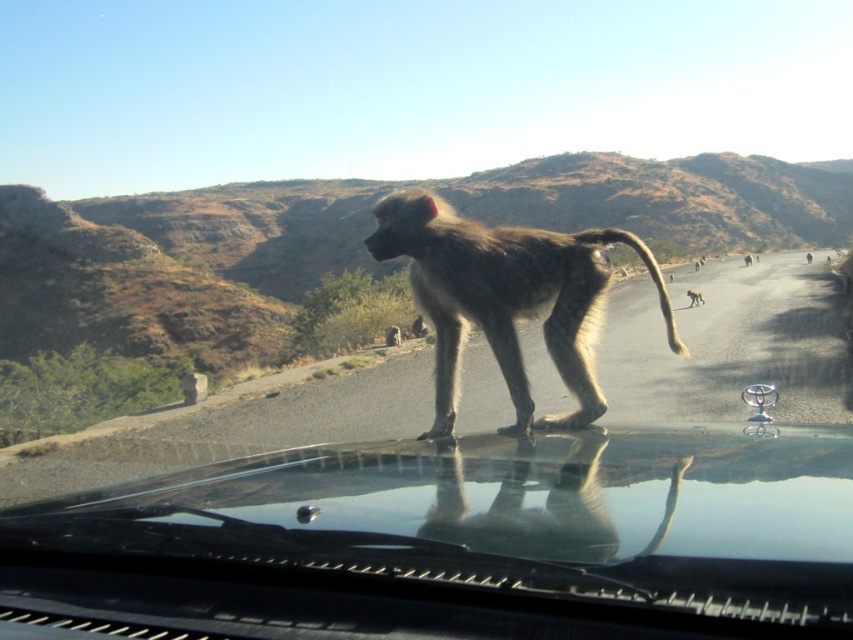
Question: Does transparent glass windshield at center come behind fuzzy brown monkey at center?

Choices:
 (A) yes
 (B) no

Answer: (B)

Question: Based on their relative distances, which object is nearer to the transparent glass windshield at center?

Choices:
 (A) fuzzy brown monkey at center
 (B) gray fur monkey at center

Answer: (B)

Question: Which of the following is the farthest from the observer?

Choices:
 (A) (248, 477)
 (B) (401, 237)
 (C) (694, 301)

Answer: (C)

Question: Among these points, which one is nearest to the camera?

Choices:
 (A) (622, 237)
 (B) (689, 304)

Answer: (A)

Question: Does transparent glass windshield at center have a larger size compared to fuzzy brown monkey at center?

Choices:
 (A) yes
 (B) no

Answer: (A)

Question: Does transparent glass windshield at center lie in front of fuzzy brown monkey at center?

Choices:
 (A) yes
 (B) no

Answer: (A)